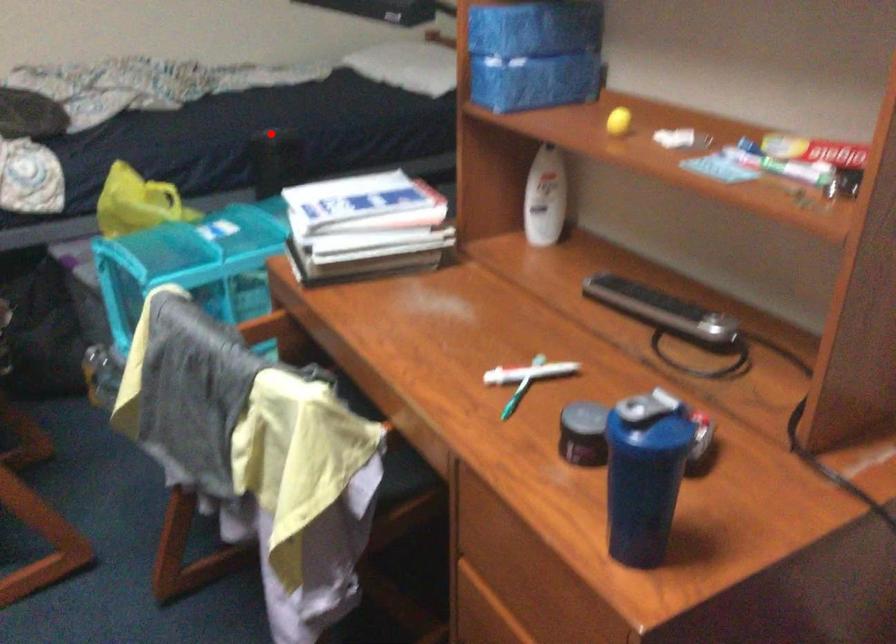
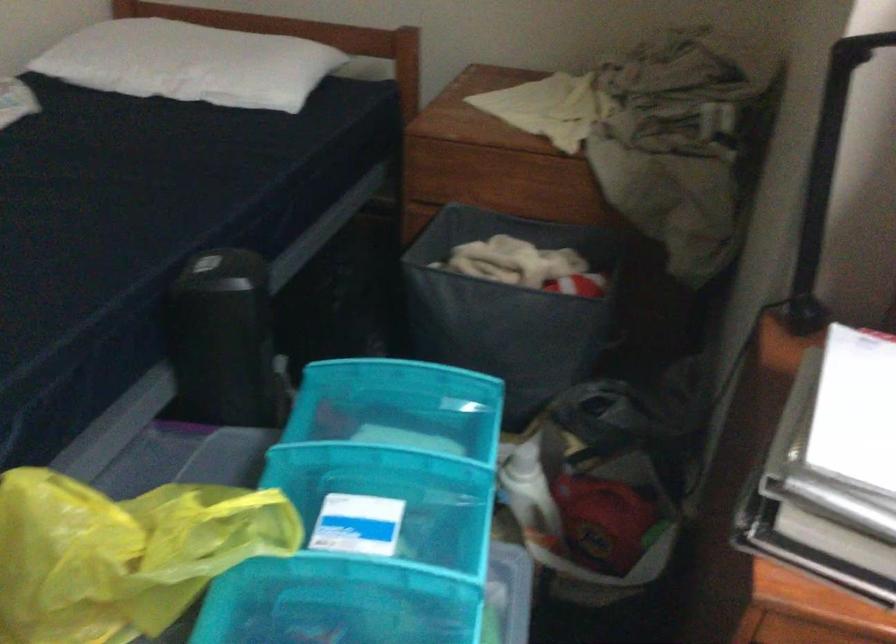
Locate, in the second image, the point that corresponds to the highlighted location in the first image.

(225, 268)